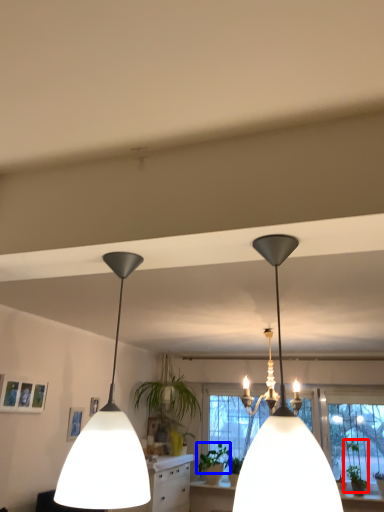
Question: Which object appears farthest to the camera in this image, plant (highlighted by a red box) or plant (highlighted by a blue box)?

Choices:
 (A) plant
 (B) plant

Answer: (B)